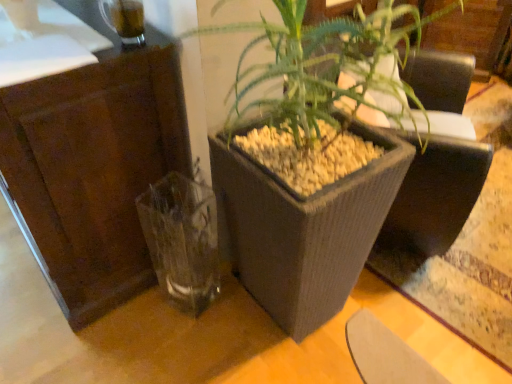
Question: Is brown wood dresser at left smaller than transparent glass vase at lower left?

Choices:
 (A) no
 (B) yes

Answer: (A)

Question: Considering the relative sizes of brown wood dresser at left and transparent glass vase at lower left in the image provided, is brown wood dresser at left taller than transparent glass vase at lower left?

Choices:
 (A) yes
 (B) no

Answer: (A)

Question: Is brown wood dresser at left positioned with its back to transparent glass vase at lower left?

Choices:
 (A) no
 (B) yes

Answer: (A)

Question: Considering the relative sizes of brown wood dresser at left and transparent glass vase at lower left in the image provided, is brown wood dresser at left bigger than transparent glass vase at lower left?

Choices:
 (A) no
 (B) yes

Answer: (B)

Question: Can you confirm if brown wood dresser at left is thinner than transparent glass vase at lower left?

Choices:
 (A) yes
 (B) no

Answer: (B)

Question: Is brown wood dresser at left oriented towards transparent glass vase at lower left?

Choices:
 (A) no
 (B) yes

Answer: (A)

Question: Would you say matte gray planter at center is part of brown wood dresser at left's contents?

Choices:
 (A) no
 (B) yes

Answer: (A)

Question: Does brown wood dresser at left have a lesser width compared to matte gray planter at center?

Choices:
 (A) no
 (B) yes

Answer: (A)

Question: Is brown wood dresser at left positioned before matte gray planter at center?

Choices:
 (A) no
 (B) yes

Answer: (A)

Question: From the image's perspective, is brown wood dresser at left beneath matte gray planter at center?

Choices:
 (A) yes
 (B) no

Answer: (B)

Question: From a real-world perspective, is brown wood dresser at left on top of matte gray planter at center?

Choices:
 (A) no
 (B) yes

Answer: (A)

Question: Is brown wood dresser at left positioned far away from matte gray planter at center?

Choices:
 (A) yes
 (B) no

Answer: (B)

Question: Can you confirm if matte gray planter at center is bigger than transparent glass vase at lower left?

Choices:
 (A) no
 (B) yes

Answer: (B)